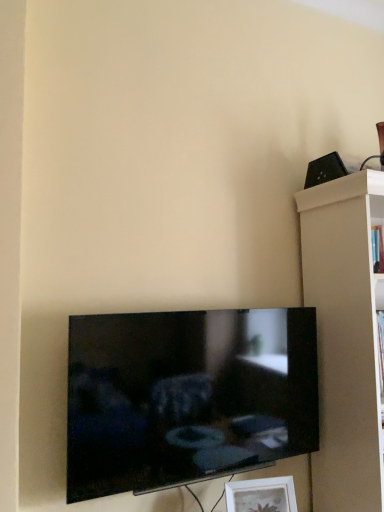
Question: Considering the relative sizes of black glossy tv at lower center and white matte shelf at right in the image provided, is black glossy tv at lower center smaller than white matte shelf at right?

Choices:
 (A) no
 (B) yes

Answer: (B)

Question: Is black glossy tv at lower center outside white matte shelf at right?

Choices:
 (A) yes
 (B) no

Answer: (A)

Question: Is black glossy tv at lower center aimed at white matte shelf at right?

Choices:
 (A) no
 (B) yes

Answer: (A)

Question: Can white matte shelf at right be found inside black glossy tv at lower center?

Choices:
 (A) no
 (B) yes

Answer: (A)

Question: Is black glossy tv at lower center closer to the viewer compared to white matte shelf at right?

Choices:
 (A) no
 (B) yes

Answer: (B)

Question: From a real-world perspective, does black glossy tv at lower center sit lower than white matte shelf at right?

Choices:
 (A) no
 (B) yes

Answer: (B)

Question: Is white matte shelf at right next to white matte picture frame at lower center and touching it?

Choices:
 (A) no
 (B) yes

Answer: (A)

Question: Considering the relative sizes of white matte shelf at right and white matte picture frame at lower center in the image provided, is white matte shelf at right thinner than white matte picture frame at lower center?

Choices:
 (A) yes
 (B) no

Answer: (B)

Question: From the image's perspective, is white matte shelf at right on top of white matte picture frame at lower center?

Choices:
 (A) yes
 (B) no

Answer: (A)

Question: Can we say white matte shelf at right lies outside white matte picture frame at lower center?

Choices:
 (A) yes
 (B) no

Answer: (A)

Question: Is white matte shelf at right at the right side of white matte picture frame at lower center?

Choices:
 (A) no
 (B) yes

Answer: (B)

Question: Does white matte shelf at right lie behind white matte picture frame at lower center?

Choices:
 (A) yes
 (B) no

Answer: (A)

Question: From a real-world perspective, is white matte picture frame at lower center over black glossy tv at lower center?

Choices:
 (A) no
 (B) yes

Answer: (A)